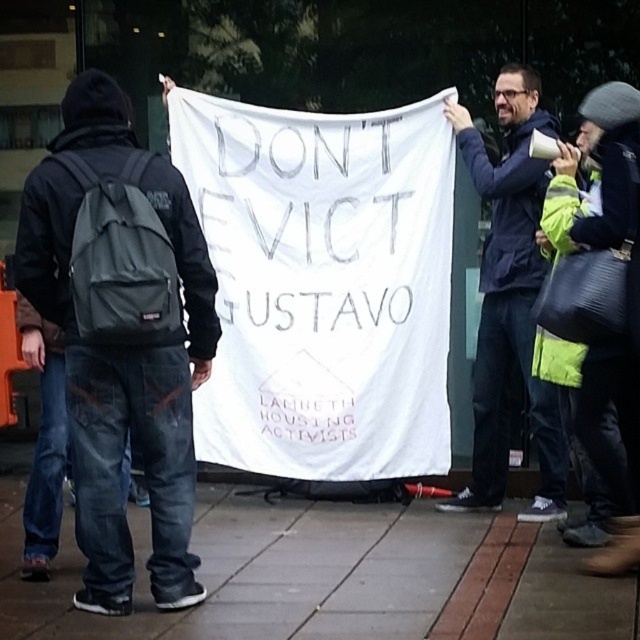
Question: Is dark gray backpack at center behind dark blue jacket at center?

Choices:
 (A) yes
 (B) no

Answer: (B)

Question: Observing the image, what is the correct spatial positioning of white fabric banner at center in reference to green reflective jacket at upper right?

Choices:
 (A) above
 (B) below

Answer: (A)

Question: Does white fabric banner at center appear under green reflective jacket at upper right?

Choices:
 (A) no
 (B) yes

Answer: (A)

Question: Which object is farther from the camera taking this photo?

Choices:
 (A) green reflective jacket at upper right
 (B) white fabric banner at center

Answer: (B)

Question: Considering the real-world distances, which object is closest to the green reflective jacket at upper right?

Choices:
 (A) dark blue jacket at center
 (B) white fabric banner at center

Answer: (A)

Question: Which object is positioned farthest from the dark blue jacket at center?

Choices:
 (A) green reflective jacket at upper right
 (B) dark gray backpack at center
 (C) white fabric banner at center

Answer: (B)